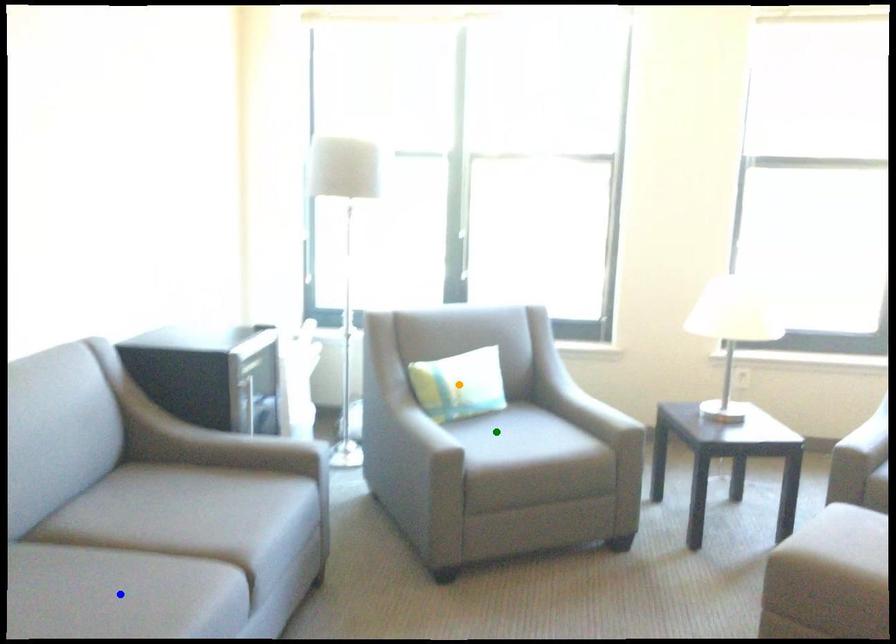
Order these from nearest to farthest:
blue point | green point | orange point

orange point < green point < blue point